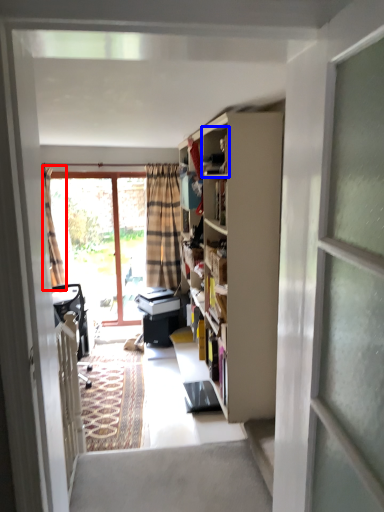
Question: Which object appears closest to the camera in this image, curtain (highlighted by a red box) or cabinet (highlighted by a blue box)?

Choices:
 (A) curtain
 (B) cabinet

Answer: (B)